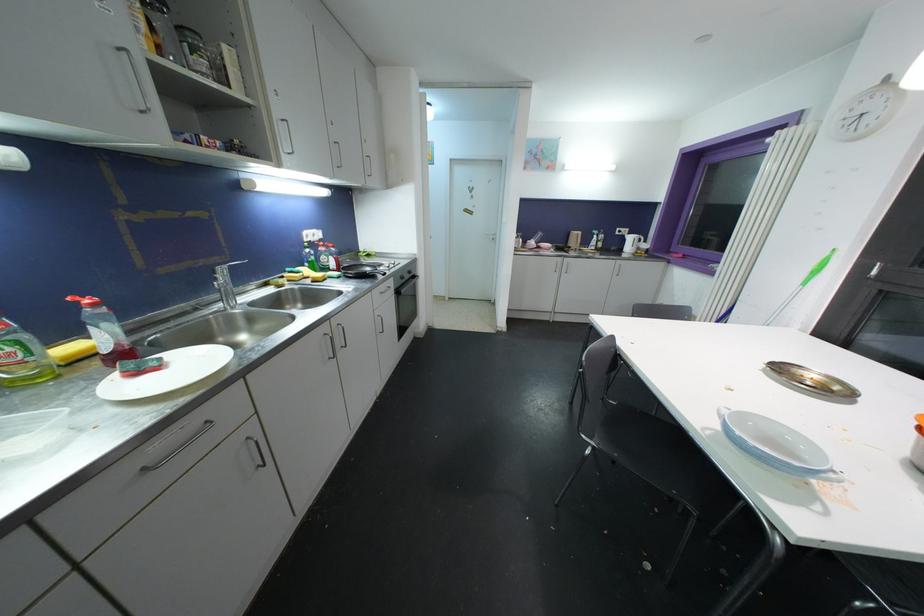
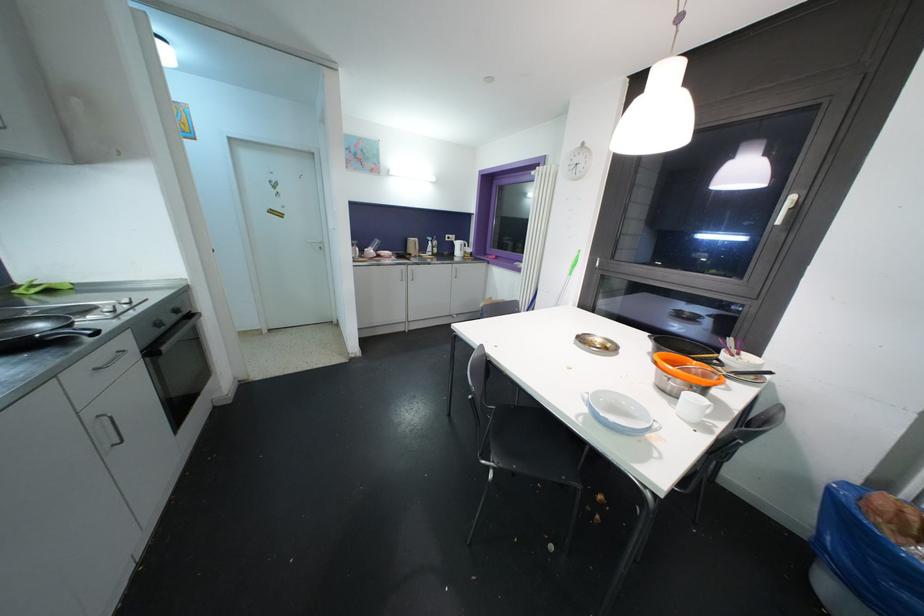
Question: The camera is either moving clockwise (left) or counter-clockwise (right) around the object. The first image is from the beginning of the video and the second image is from the end. Is the camera moving left or right when shooting the video?

Choices:
 (A) Left
 (B) Right

Answer: (A)